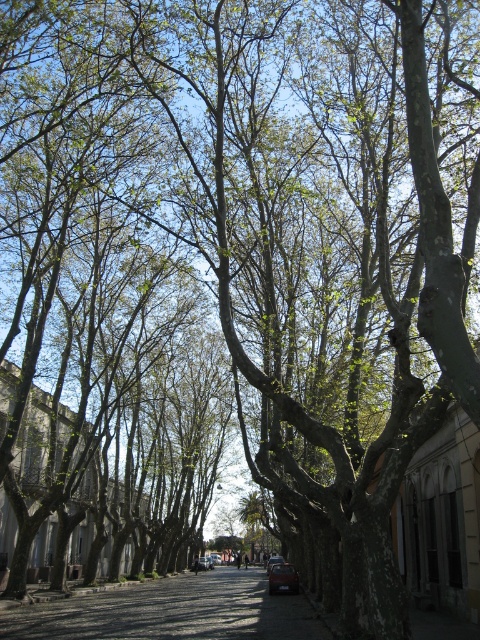
You are standing at the entrance of the street and want to find the shiny red car at center. According to the coordinates provided, where should you look relative to your position?

The shiny red car at center is located at point coordinates, so you should look towards the center of the street to find it.

You are standing at the point marked by the coordinates (x=204, y=563) in the image. What object are you currently standing on?

You are standing on the matte red car at center.